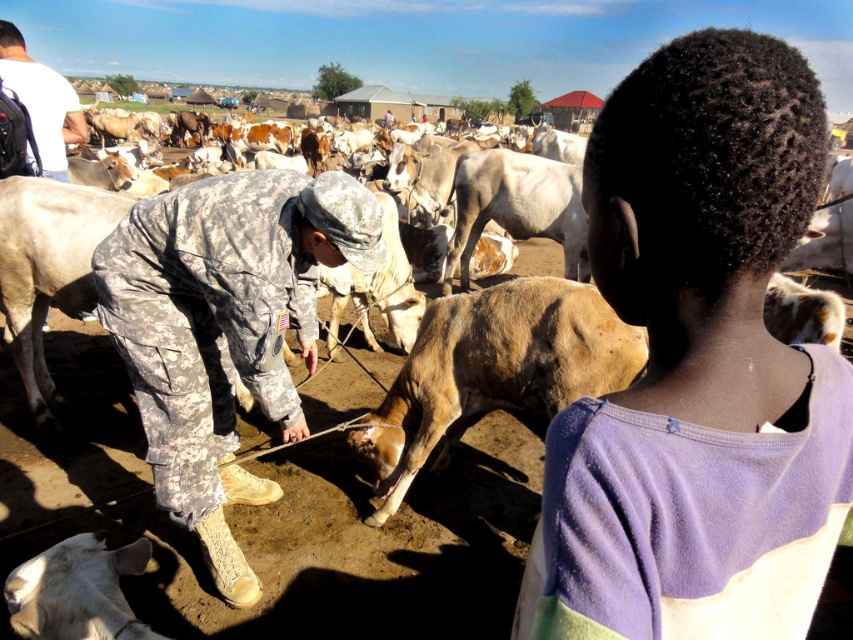
Does brown rough cow at center appear under white matte cow at lower left?

Incorrect, brown rough cow at center is not positioned below white matte cow at lower left.

Does brown rough cow at center appear on the right side of white matte cow at lower left?

Yes, brown rough cow at center is to the right of white matte cow at lower left.

Is point (476, 352) farther from viewer compared to point (135, 572)?

Yes, point (476, 352) is farther from viewer.

What are the coordinates of `brown rough cow at center` in the screenshot? It's located at (492, 371).

Between white matte cow at lower left and white matte shirt at upper left, which one has more height?

Standing taller between the two is white matte shirt at upper left.

Can you confirm if white matte cow at lower left is positioned to the left of white matte shirt at upper left?

In fact, white matte cow at lower left is to the right of white matte shirt at upper left.

Consider the image. Who is more distant from viewer, (125, 547) or (28, 150)?

Point (28, 150)

At what (x,y) coordinates should I click in order to perform the action: click on white matte cow at lower left. Please return your answer as a coordinate pair (x, y). Looking at the image, I should click on (77, 592).

Is the position of camouflage fabric soldier at center more distant than that of brown rough cow at center?

No, camouflage fabric soldier at center is in front of brown rough cow at center.

Does camouflage fabric soldier at center have a smaller size compared to brown rough cow at center?

No.

Between point (192, 186) and point (558, 323), which one is positioned in front?

Point (192, 186) is in front.

The image size is (853, 640). I want to click on camouflage fabric soldier at center, so click(x=224, y=326).